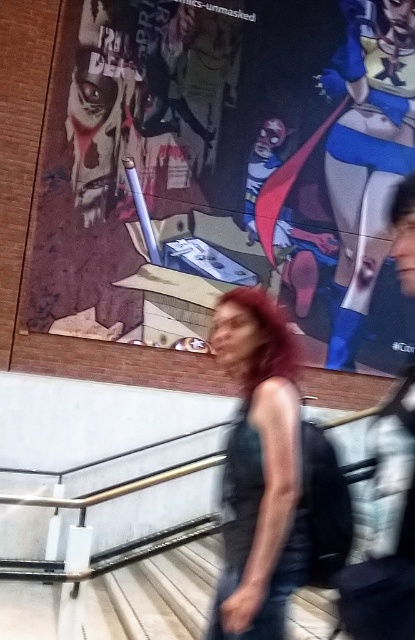
You are an artist standing in the urban scene and want to place a new sticker exactly 0.1 units to the right and 0.05 units above the matte paper poster at upper center. What are the coordinates where you should place the sticker?

The coordinates for the sticker placement would be calculated by adding 0.1 to the x coordinate and 0.05 to the y coordinate of the matte paper poster at upper center. The original coordinates are at point (226,172). Adding 0.1 to the x gives 0.369, and adding 0.05 to the y gives 0.595. Therefore, the sticker should be placed at coordinates (246,236).

You are an artist who wants to hang a new poster on the wall. You see the matte paper poster at upper center and the wooden stairs at lower center. Which object is bigger?

The matte paper poster at upper center is larger in size than the wooden stairs at lower center.